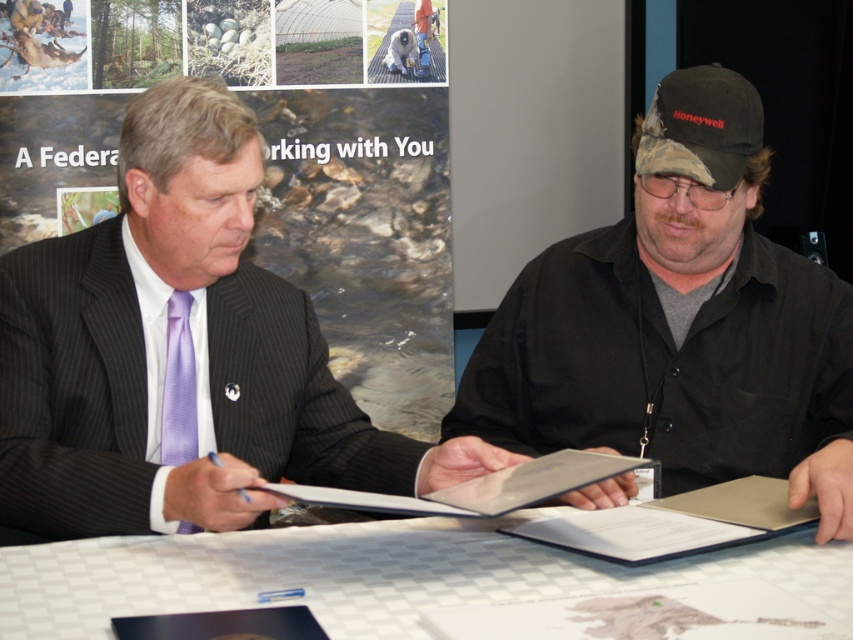
You are a tailor who needs to determine if the black matte shirt at center can be folded and placed into the beige leather book at center. Based on their sizes, can the shirt fit inside the book?

The black matte shirt at center is wider than the beige leather book at center, so it cannot fit inside the book.